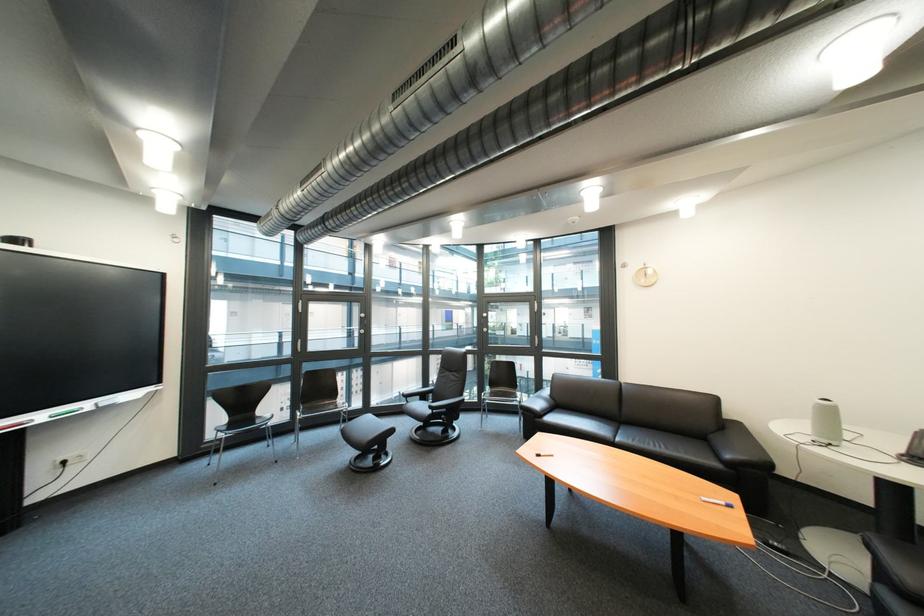
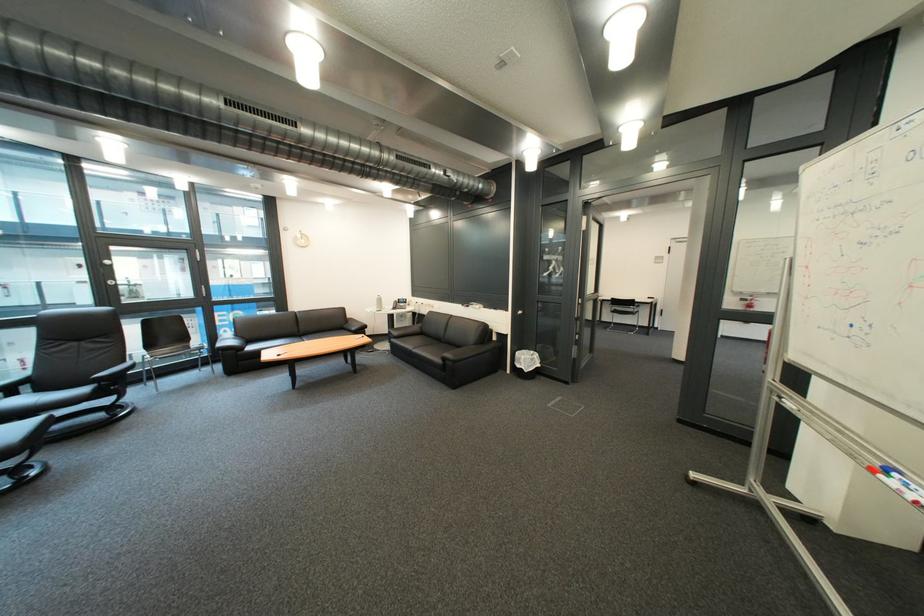
The point at [432,399] is marked in the first image. Where is the corresponding point in the second image?

(16, 395)